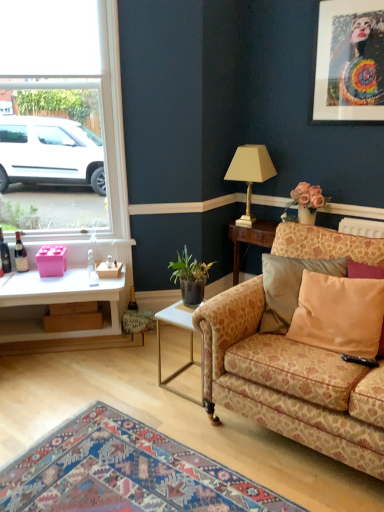
Find the location of a particular element. This screenshot has width=384, height=512. vacant space situated on the left part of pink matte plastic box at left, the second box in the bottom-to-top sequence is located at coordinates (21, 276).